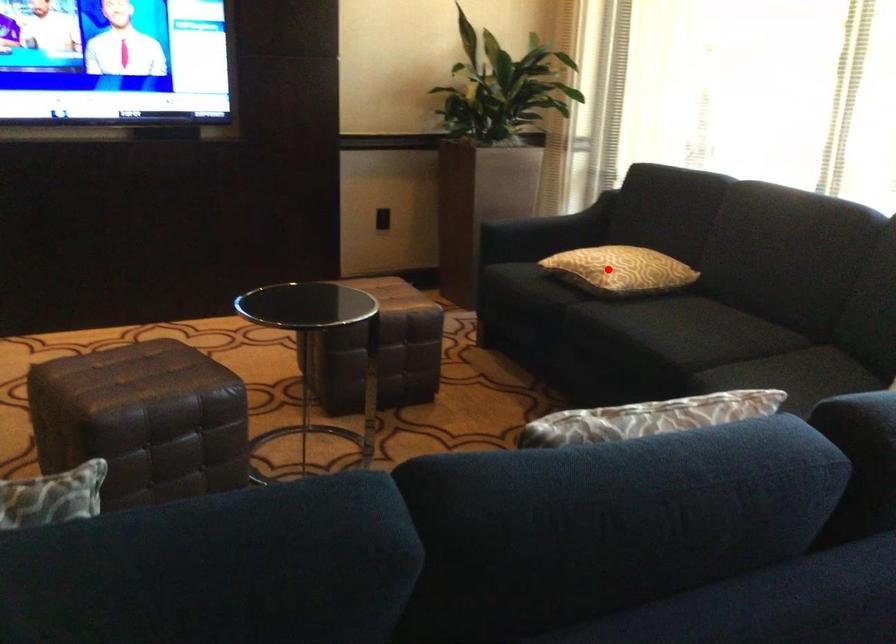
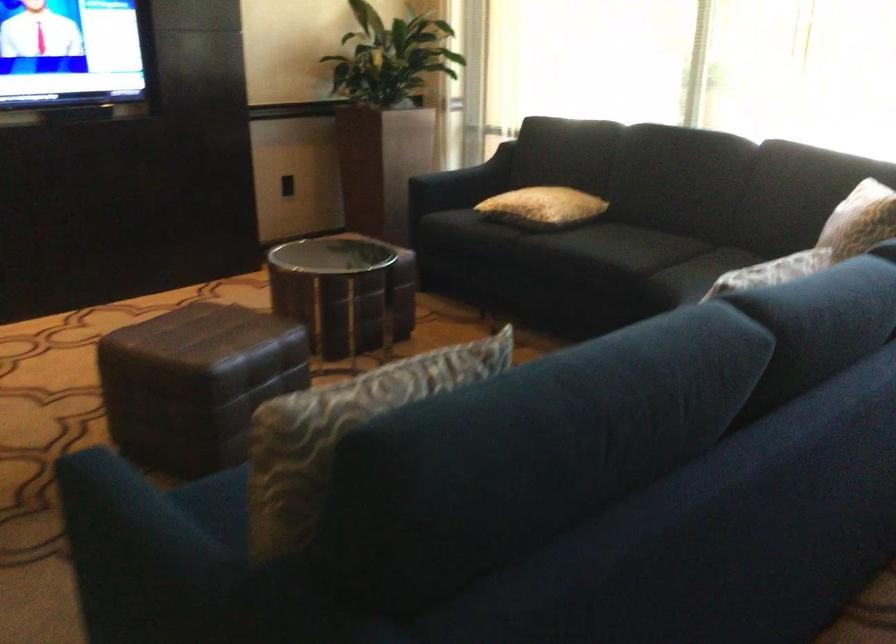
The point at the highlighted location is marked in the first image. Where is the corresponding point in the second image?

(543, 207)